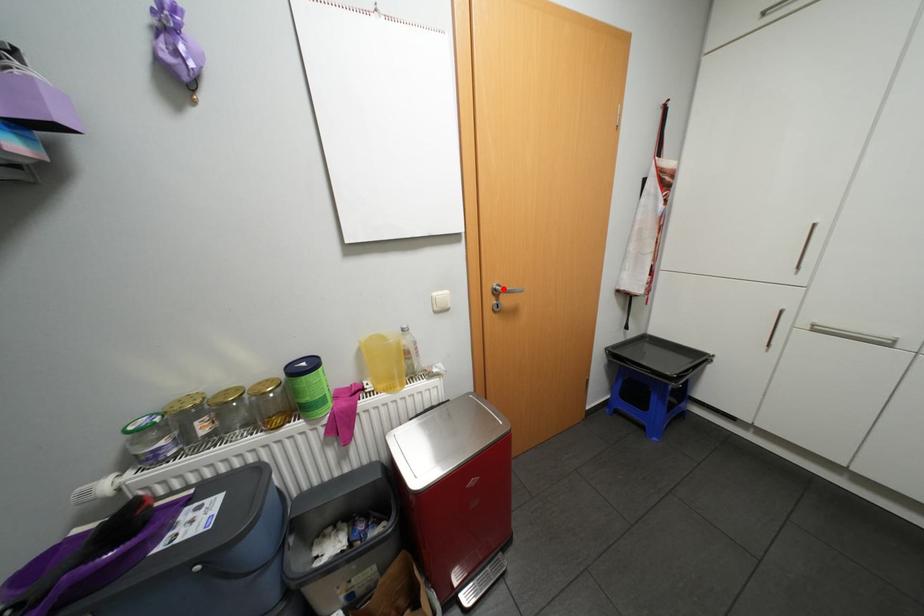
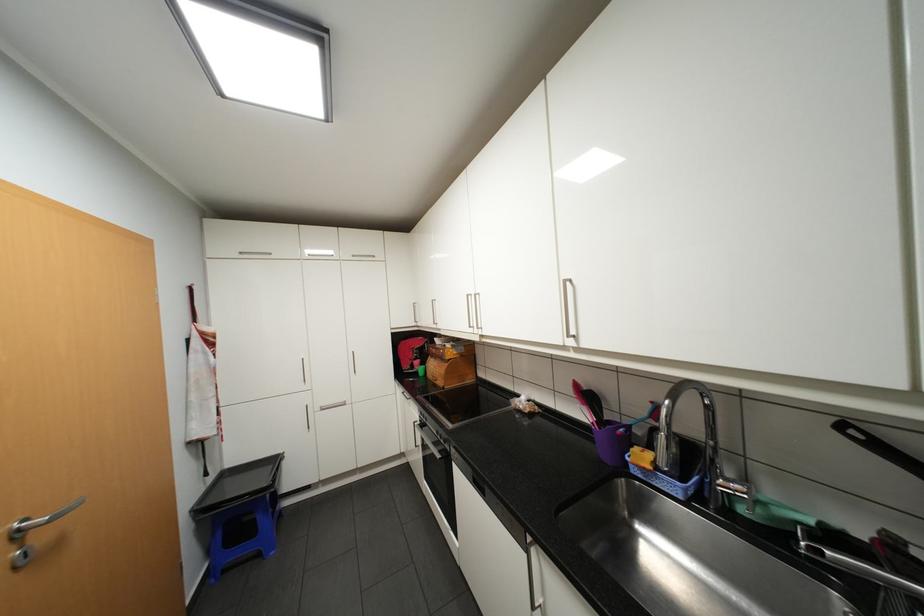
In the second image, find the point that corresponds to the highlighted location in the first image.

(27, 530)